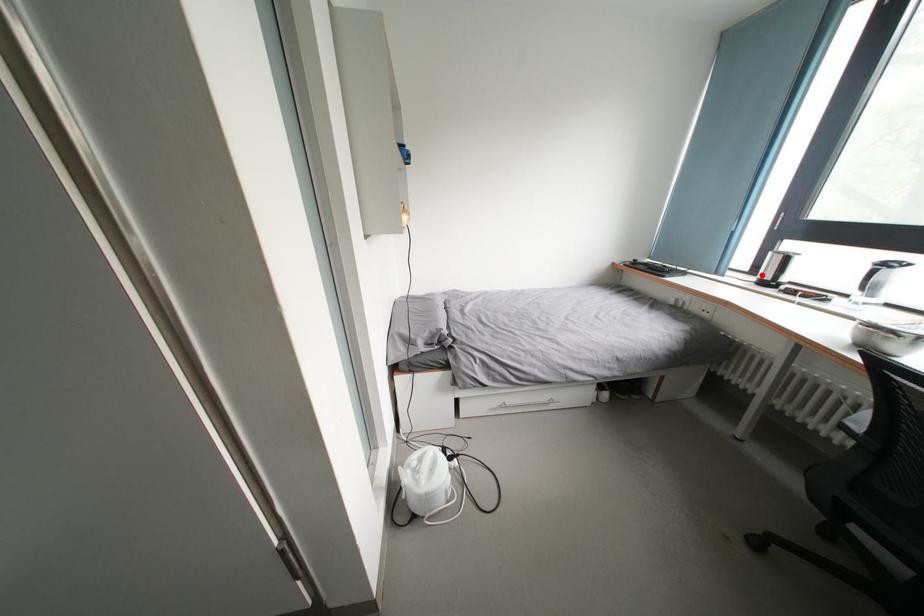
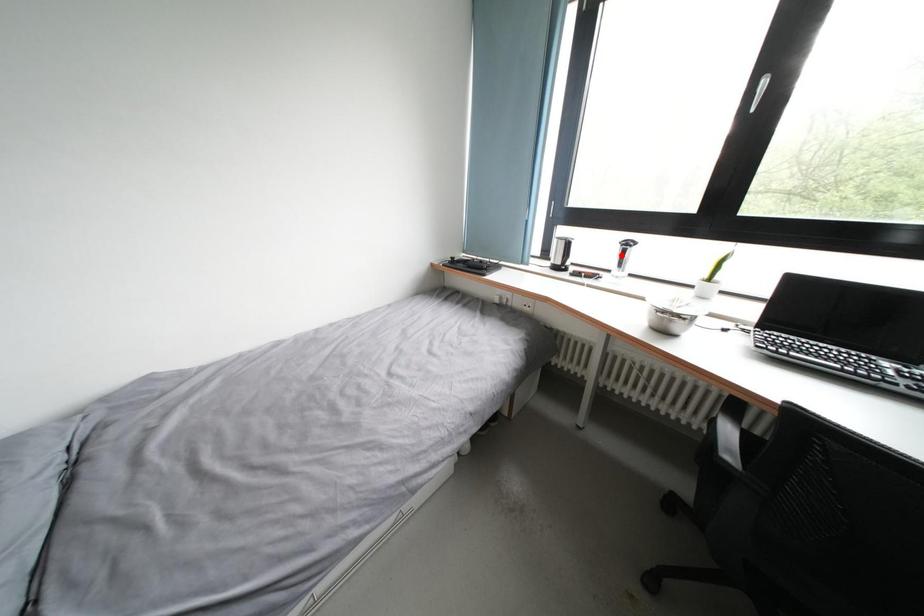
I am providing you with two images of the same scene from different viewpoints. A red point is marked on the first image and another point is marked on the second image. Do the highlighted points in image1 and image2 indicate the same real-world spot?

No